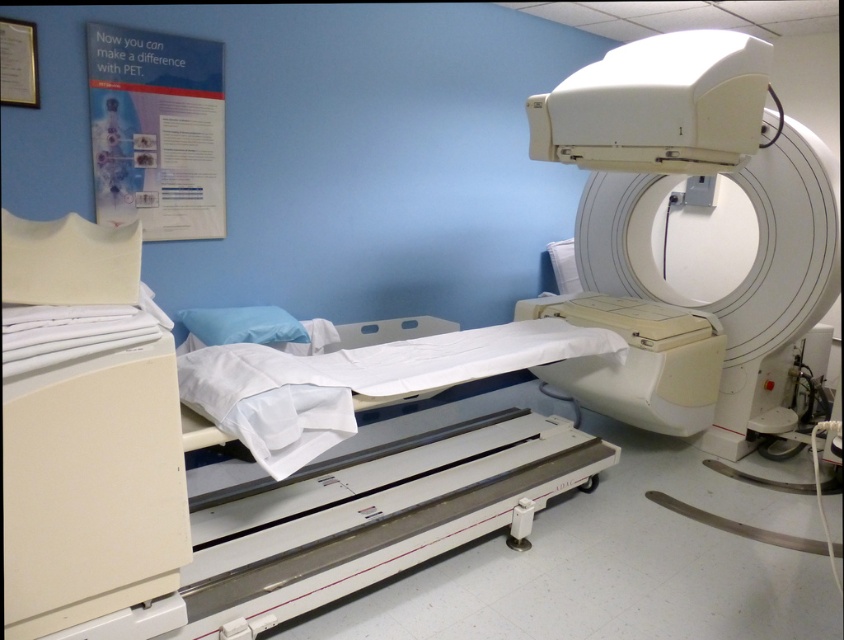
Question: Is white paper at upper left below beige plastic scanner at center?

Choices:
 (A) no
 (B) yes

Answer: (A)

Question: From the image, what is the correct spatial relationship of white paper at upper left in relation to blue fabric pillow at center?

Choices:
 (A) above
 (B) below

Answer: (A)

Question: Does white paper at upper left appear over blue fabric pillow at center?

Choices:
 (A) no
 (B) yes

Answer: (B)

Question: Which point is closer to the camera taking this photo?

Choices:
 (A) (268, 310)
 (B) (126, 81)

Answer: (B)

Question: Which point appears closest to the camera in this image?

Choices:
 (A) (655, 429)
 (B) (211, 312)
 (C) (147, 77)

Answer: (C)

Question: Which of these objects is positioned closest to the white paper at upper left?

Choices:
 (A) beige plastic scanner at center
 (B) blue fabric pillow at center

Answer: (B)